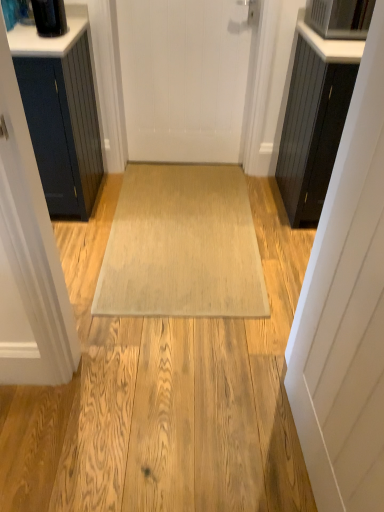
Question: Can white matte door at right, the 2th door in the top-to-bottom sequence, be found inside black wood cabinet at right?

Choices:
 (A) no
 (B) yes

Answer: (A)

Question: Are black wood cabinet at right and white matte door at right, which ranks as the first door in bottom-to-top order, making contact?

Choices:
 (A) no
 (B) yes

Answer: (A)

Question: Is the position of black wood cabinet at right less distant than that of white matte door at right, which ranks as the first door in bottom-to-top order?

Choices:
 (A) no
 (B) yes

Answer: (A)

Question: Is black wood cabinet at right thinner than white matte door at right, the second door in the left-to-right sequence?

Choices:
 (A) yes
 (B) no

Answer: (B)

Question: Can you confirm if black wood cabinet at right is positioned to the right of white matte door at right, the second door in the left-to-right sequence?

Choices:
 (A) yes
 (B) no

Answer: (A)

Question: In terms of size, does black wood cabinet at right appear bigger or smaller than black glossy container at upper left?

Choices:
 (A) big
 (B) small

Answer: (A)

Question: Looking at their shapes, would you say black wood cabinet at right is wider or thinner than black glossy container at upper left?

Choices:
 (A) wide
 (B) thin

Answer: (A)

Question: Visually, is black wood cabinet at right positioned to the left or to the right of black glossy container at upper left?

Choices:
 (A) left
 (B) right

Answer: (B)

Question: From their relative heights in the image, would you say black wood cabinet at right is taller or shorter than black glossy container at upper left?

Choices:
 (A) tall
 (B) short

Answer: (A)

Question: Based on their positions, is satin silver microwave at upper right located to the left or right of black wood cabinet at right?

Choices:
 (A) left
 (B) right

Answer: (A)

Question: Considering the positions of satin silver microwave at upper right and black wood cabinet at right in the image, is satin silver microwave at upper right bigger or smaller than black wood cabinet at right?

Choices:
 (A) small
 (B) big

Answer: (A)

Question: Is satin silver microwave at upper right taller or shorter than black wood cabinet at right?

Choices:
 (A) tall
 (B) short

Answer: (B)

Question: From the image's perspective, is satin silver microwave at upper right located above or below black wood cabinet at right?

Choices:
 (A) below
 (B) above

Answer: (B)

Question: In the image, is beige woven mat at center positioned in front of or behind black wood cabinet at right?

Choices:
 (A) front
 (B) behind

Answer: (B)

Question: Is beige woven mat at center wider or thinner than black wood cabinet at right?

Choices:
 (A) wide
 (B) thin

Answer: (A)